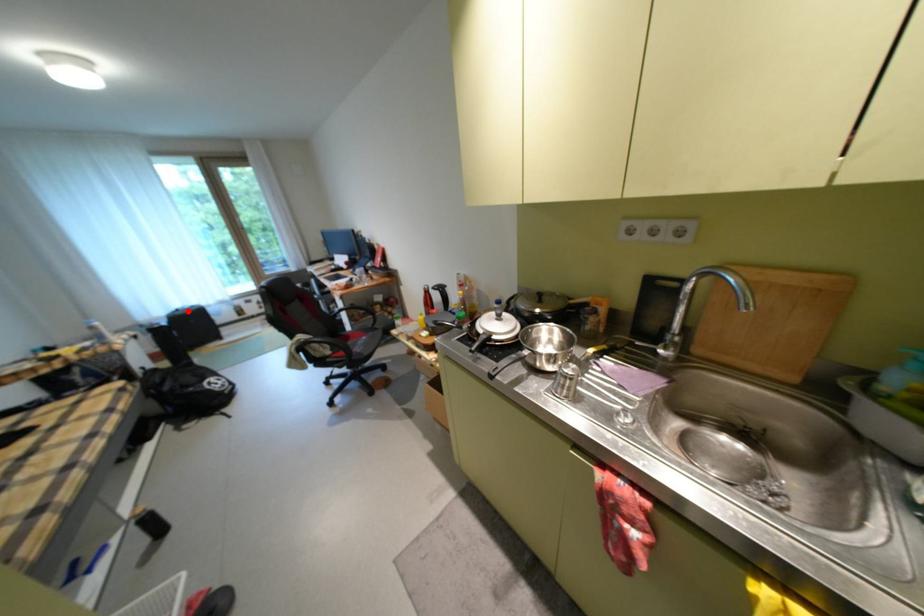
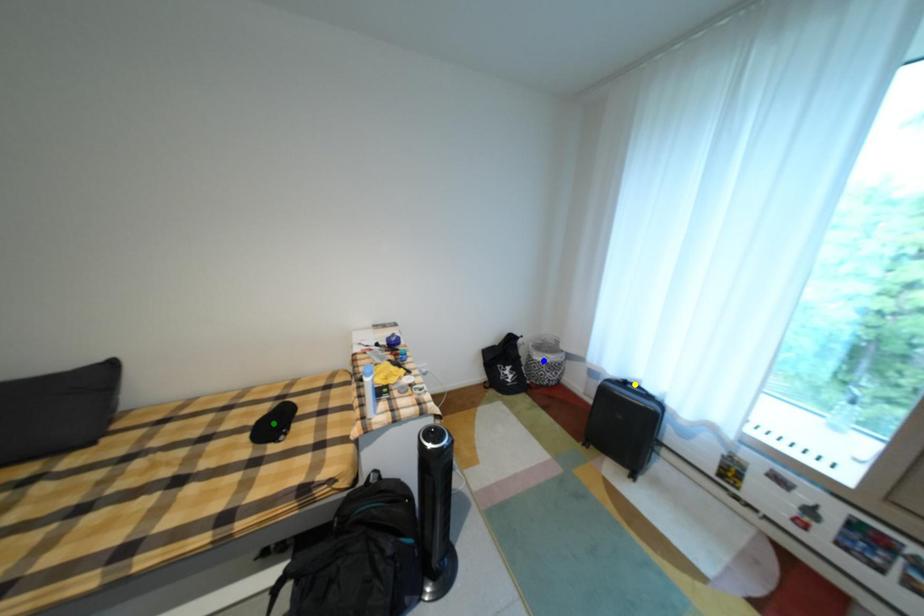
Question: I am providing you with two images of the same scene from different viewpoints. A red point is marked on the first image. You are given multiple points on the second image. Which point in image 2 represents the same 3d spot as the red point in image 1?

Choices:
 (A) yellow point
 (B) green point
 (C) blue point

Answer: (A)